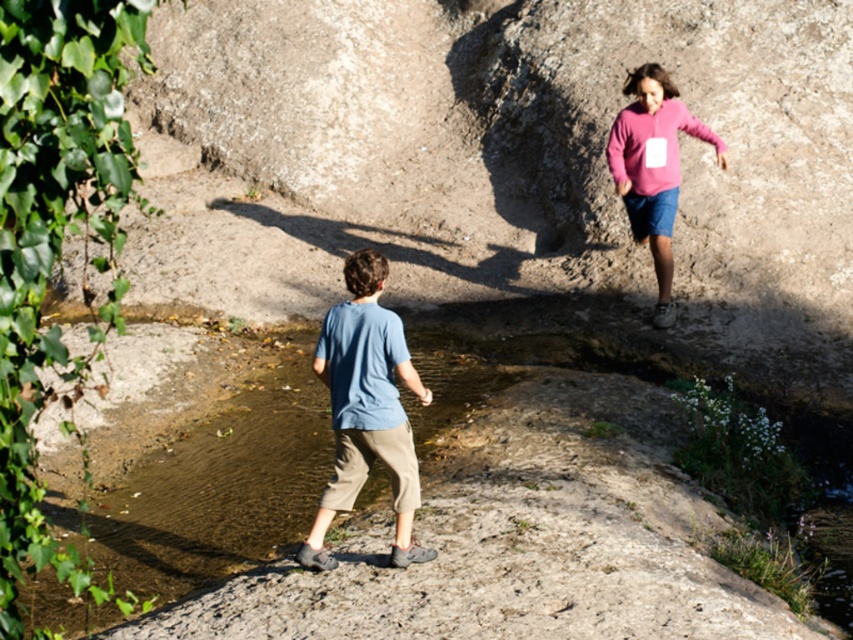
Question: Which of the following is the farthest from the observer?

Choices:
 (A) (672, 189)
 (B) (379, 358)

Answer: (A)

Question: Is blue cotton shirt at center thinner than pink fleece sweater at upper right?

Choices:
 (A) yes
 (B) no

Answer: (A)

Question: Considering the relative positions of blue cotton shirt at center and pink fleece sweater at upper right in the image provided, where is blue cotton shirt at center located with respect to pink fleece sweater at upper right?

Choices:
 (A) left
 (B) right

Answer: (A)

Question: Does blue cotton shirt at center have a lesser width compared to pink fleece sweater at upper right?

Choices:
 (A) no
 (B) yes

Answer: (B)